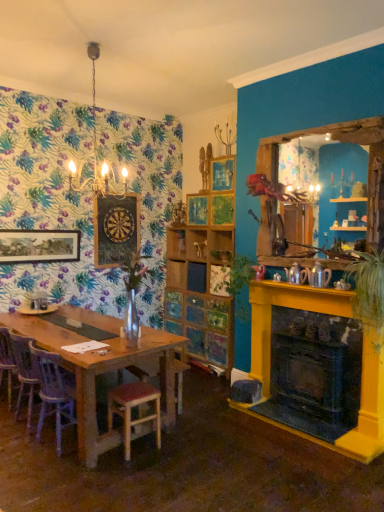
Question: From a real-world perspective, is wooden at left, placed as the 1th chair when sorted from front to back, located higher than metallic yellow fireplace at right?

Choices:
 (A) yes
 (B) no

Answer: (B)

Question: Is metallic yellow fireplace at right a part of wooden at left, placed as the 1th chair when sorted from front to back?

Choices:
 (A) no
 (B) yes

Answer: (A)

Question: Are wooden at left, which is the 2th chair in back-to-front order, and metallic yellow fireplace at right beside each other?

Choices:
 (A) yes
 (B) no

Answer: (B)

Question: Is wooden at left, placed as the 1th chair when sorted from front to back, looking in the opposite direction of metallic yellow fireplace at right?

Choices:
 (A) no
 (B) yes

Answer: (A)

Question: Does wooden at left, which is the 2th chair in back-to-front order, have a greater height compared to metallic yellow fireplace at right?

Choices:
 (A) yes
 (B) no

Answer: (B)

Question: Considering the positions of point click(173, 234) and point click(44, 362), is point click(173, 234) closer or farther from the camera than point click(44, 362)?

Choices:
 (A) closer
 (B) farther

Answer: (B)

Question: From a real-world perspective, is wooden shelf at center above or below wooden at left, placed as the 1th chair when sorted from front to back?

Choices:
 (A) below
 (B) above

Answer: (B)

Question: Is wooden shelf at center in front of or behind wooden at left, placed as the 1th chair when sorted from front to back, in the image?

Choices:
 (A) behind
 (B) front

Answer: (A)

Question: Looking at the image, does wooden shelf at center seem bigger or smaller compared to wooden at left, which is the 2th chair in back-to-front order?

Choices:
 (A) small
 (B) big

Answer: (A)

Question: Is white porcelain plate at left bigger or smaller than wooden at left, which is the 2th chair in back-to-front order?

Choices:
 (A) big
 (B) small

Answer: (B)

Question: Do you think white porcelain plate at left is within wooden at left, placed as the 1th chair when sorted from front to back, or outside of it?

Choices:
 (A) outside
 (B) inside

Answer: (A)

Question: In terms of height, does white porcelain plate at left look taller or shorter compared to wooden at left, placed as the 1th chair when sorted from front to back?

Choices:
 (A) short
 (B) tall

Answer: (A)

Question: Does point (52, 309) appear closer or farther from the camera than point (54, 382)?

Choices:
 (A) farther
 (B) closer

Answer: (A)

Question: Considering the positions of white porcelain plate at left and green leafy plant at center, which is counted as the 2th plant, starting from the right, in the image, is white porcelain plate at left wider or thinner than green leafy plant at center, which is counted as the 2th plant, starting from the right,?

Choices:
 (A) thin
 (B) wide

Answer: (A)

Question: In terms of height, does white porcelain plate at left look taller or shorter compared to green leafy plant at center, marked as the first plant in a left-to-right arrangement?

Choices:
 (A) tall
 (B) short

Answer: (B)